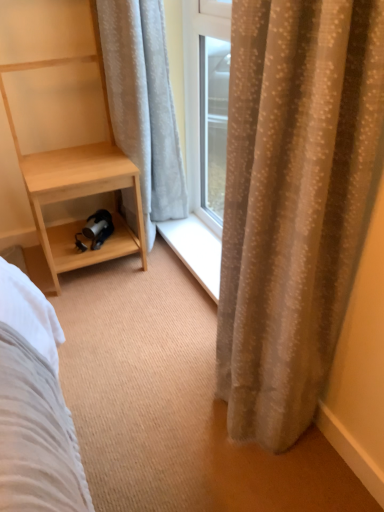
Question: From the image's perspective, does beige textured curtain at right, acting as the 2th curtain starting from the left, appear higher than white textured curtain at left, the 2th curtain when ordered from right to left?

Choices:
 (A) yes
 (B) no

Answer: (B)

Question: Does beige textured curtain at right, positioned as the 1th curtain in front-to-back order, have a smaller size compared to white textured curtain at left, the 1th curtain when ordered from left to right?

Choices:
 (A) yes
 (B) no

Answer: (B)

Question: Could you tell me if beige textured curtain at right, acting as the 2th curtain starting from the left, is turned towards white textured curtain at left, the 2th curtain when ordered from right to left?

Choices:
 (A) no
 (B) yes

Answer: (A)

Question: Can you confirm if beige textured curtain at right, acting as the 2th curtain starting from the left, is wider than white textured curtain at left, the 1th curtain when ordered from left to right?

Choices:
 (A) no
 (B) yes

Answer: (B)

Question: Does beige textured curtain at right, which is counted as the second curtain, starting from the back, contain white textured curtain at left, the 1th curtain when ordered from left to right?

Choices:
 (A) yes
 (B) no

Answer: (B)

Question: Is beige textured curtain at right, acting as the 2th curtain starting from the left, turned away from white textured curtain at left, acting as the 2th curtain starting from the front?

Choices:
 (A) no
 (B) yes

Answer: (A)

Question: From the image's perspective, does white textured curtain at left, marked as the first curtain in a back-to-front arrangement, appear higher than light wood/texture shelf at left?

Choices:
 (A) yes
 (B) no

Answer: (A)

Question: Considering the relative sizes of white textured curtain at left, the 2th curtain when ordered from right to left, and light wood/texture shelf at left in the image provided, is white textured curtain at left, the 2th curtain when ordered from right to left, shorter than light wood/texture shelf at left?

Choices:
 (A) yes
 (B) no

Answer: (A)

Question: From the image's perspective, does white textured curtain at left, acting as the 2th curtain starting from the front, appear lower than light wood/texture shelf at left?

Choices:
 (A) yes
 (B) no

Answer: (B)

Question: Is white textured curtain at left, acting as the 2th curtain starting from the front, in contact with light wood/texture shelf at left?

Choices:
 (A) yes
 (B) no

Answer: (B)

Question: Is white textured curtain at left, acting as the 2th curtain starting from the front, to the left of light wood/texture shelf at left from the viewer's perspective?

Choices:
 (A) no
 (B) yes

Answer: (A)

Question: Is white textured curtain at left, marked as the first curtain in a back-to-front arrangement, positioned before light wood/texture shelf at left?

Choices:
 (A) yes
 (B) no

Answer: (B)

Question: Considering the relative sizes of light wood/texture shelf at left and beige textured curtain at right, which is counted as the second curtain, starting from the back, in the image provided, is light wood/texture shelf at left smaller than beige textured curtain at right, which is counted as the second curtain, starting from the back,?

Choices:
 (A) yes
 (B) no

Answer: (B)